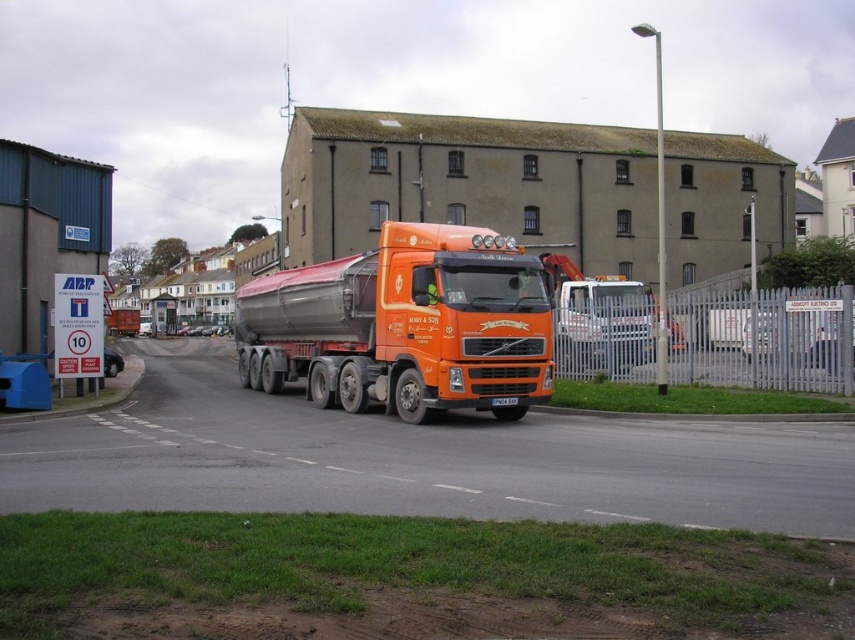
Question: Does orange matte tanker truck at center have a smaller size compared to orange metallic truck at center?

Choices:
 (A) yes
 (B) no

Answer: (B)

Question: Which of the following is the farthest from the observer?

Choices:
 (A) (618, 349)
 (B) (420, 404)

Answer: (A)

Question: Which point appears closest to the camera in this image?

Choices:
 (A) (569, 358)
 (B) (388, 337)

Answer: (B)

Question: Which point is farther from the camera taking this photo?

Choices:
 (A) (647, 358)
 (B) (248, 381)

Answer: (B)

Question: From the image, what is the correct spatial relationship of orange matte tanker truck at center in relation to orange metallic truck at center?

Choices:
 (A) below
 (B) above

Answer: (B)

Question: Does orange matte tanker truck at center appear under orange metallic truck at center?

Choices:
 (A) yes
 (B) no

Answer: (B)